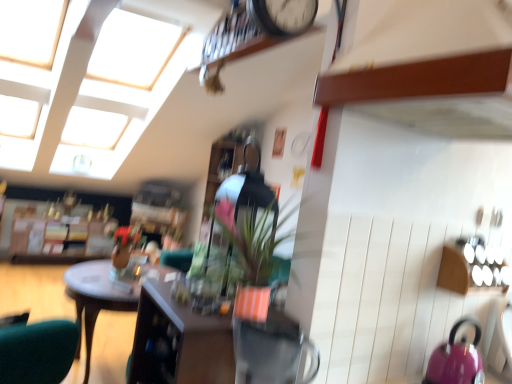
The image size is (512, 384). I want to click on matte orange pot at center, so click(x=246, y=243).

Identify the location of pink glossy kettle at lower right. (456, 359).

This screenshot has width=512, height=384. I want to click on matte wooden cabinet at center, so click(179, 342).

I want to click on wooden desk at center, so click(96, 297).

Visually, is pink glossy kettle at lower right positioned to the left or to the right of wooden desk at center?

pink glossy kettle at lower right is positioned on wooden desk at center's right side.

Are pink glossy kettle at lower right and wooden desk at center located far from each other?

That's right, there is a large distance between pink glossy kettle at lower right and wooden desk at center.

From a real-world perspective, is pink glossy kettle at lower right positioned over wooden desk at center based on gravity?

Yes, from a real-world perspective, pink glossy kettle at lower right is over wooden desk at center

Is pink glossy kettle at lower right bigger than wooden desk at center?

No, pink glossy kettle at lower right is not bigger than wooden desk at center.

How different are the orientations of matte wooden cabinet at center and matte orange pot at center in degrees?

The facing directions of matte wooden cabinet at center and matte orange pot at center are 90.4 degrees apart.

In the scene shown: Is the surface of matte wooden cabinet at center in direct contact with matte orange pot at center?

No, matte wooden cabinet at center is not making contact with matte orange pot at center.

Is matte wooden cabinet at center oriented towards matte orange pot at center?

No, matte wooden cabinet at center is not oriented towards matte orange pot at center.

Does point (453, 375) lie in front of point (270, 229)?

That is False.

Considering the sizes of objects pink glossy kettle at lower right and matte orange pot at center in the image provided, who is wider, pink glossy kettle at lower right or matte orange pot at center?

Wider between the two is matte orange pot at center.

Identify the location of plant on the left of pink glossy kettle at lower right. (246, 243).

Is matte orange pot at center positioned beyond the bounds of pink glossy kettle at lower right?

matte orange pot at center lies outside pink glossy kettle at lower right's area.

Is matte orange pot at center next to pink glossy kettle at lower right and touching it?

No, matte orange pot at center is not in contact with pink glossy kettle at lower right.

Can you confirm if matte orange pot at center is bigger than pink glossy kettle at lower right?

Yes.

This screenshot has height=384, width=512. I want to click on cabinetry lying above the pink glossy kettle at lower right (from the image's perspective), so click(x=179, y=342).

Does matte wooden cabinet at center lie behind pink glossy kettle at lower right?

No, matte wooden cabinet at center is in front of pink glossy kettle at lower right.

Is point (222, 364) farther from viewer compared to point (468, 366)?

No, (222, 364) is in front of (468, 366).

Is wooden desk at center positioned with its back to pink glossy kettle at lower right?

No, wooden desk at center is not facing the opposite direction of pink glossy kettle at lower right.

Consider the image. Who is taller, wooden desk at center or pink glossy kettle at lower right?

Standing taller between the two is wooden desk at center.

Is wooden desk at center smaller than pink glossy kettle at lower right?

No, wooden desk at center is not smaller than pink glossy kettle at lower right.

From the picture: From a real-world perspective, is wooden desk at center positioned above or below pink glossy kettle at lower right?

wooden desk at center is situated lower than pink glossy kettle at lower right in the real world.

Does wooden desk at center have a larger size compared to matte orange pot at center?

Yes, wooden desk at center is bigger than matte orange pot at center.

Which object is wider, wooden desk at center or matte orange pot at center?

With larger width is wooden desk at center.

From the image's perspective, is wooden desk at center on matte orange pot at center?

No, from the image's perspective, wooden desk at center is not on top of matte orange pot at center.

Does wooden desk at center have a greater height compared to matte orange pot at center?

Correct, wooden desk at center is much taller as matte orange pot at center.

At what (x,y) coordinates should I click in order to perform the action: click on desk behind the pink glossy kettle at lower right. Please return your answer as a coordinate pair (x, y). The image size is (512, 384). Looking at the image, I should click on (96, 297).

Locate an element on the screen. The width and height of the screenshot is (512, 384). cabinetry below the matte orange pot at center (from a real-world perspective) is located at coordinates (179, 342).

Based on their spatial positions, is matte orange pot at center or matte wooden cabinet at center closer to pink glossy kettle at lower right?

matte orange pot at center lies closer to pink glossy kettle at lower right than the other object.

Based on their spatial positions, is matte orange pot at center or matte wooden cabinet at center further from wooden desk at center?

Among the two, matte orange pot at center is located further to wooden desk at center.

Which object lies further to the anchor point pink glossy kettle at lower right, matte orange pot at center or wooden desk at center?

wooden desk at center.

Based on the photo, when comparing their distances from wooden desk at center, does matte wooden cabinet at center or pink glossy kettle at lower right seem further?

pink glossy kettle at lower right.

When comparing their distances from pink glossy kettle at lower right, does matte wooden cabinet at center or wooden desk at center seem closer?

matte wooden cabinet at center is closer to pink glossy kettle at lower right.

Which object lies nearer to the anchor point matte wooden cabinet at center, matte orange pot at center or wooden desk at center?

matte orange pot at center lies closer to matte wooden cabinet at center than the other object.

Based on their spatial positions, is matte wooden cabinet at center or matte orange pot at center further from pink glossy kettle at lower right?

Among the two, matte wooden cabinet at center is located further to pink glossy kettle at lower right.

Looking at this image, looking at the image, which one is located closer to matte orange pot at center, wooden desk at center or matte wooden cabinet at center?

matte wooden cabinet at center.

In order to click on plant between matte wooden cabinet at center and pink glossy kettle at lower right in the horizontal direction in this screenshot , I will do `click(246, 243)`.

Identify the location of plant between wooden desk at center and pink glossy kettle at lower right from left to right. (246, 243).

What are the coordinates of `plant located between matte wooden cabinet at center and wooden desk at center in the depth direction` in the screenshot? It's located at (246, 243).

The image size is (512, 384). In order to click on cabinetry located between wooden desk at center and pink glossy kettle at lower right in the left-right direction in this screenshot , I will do `click(179, 342)`.